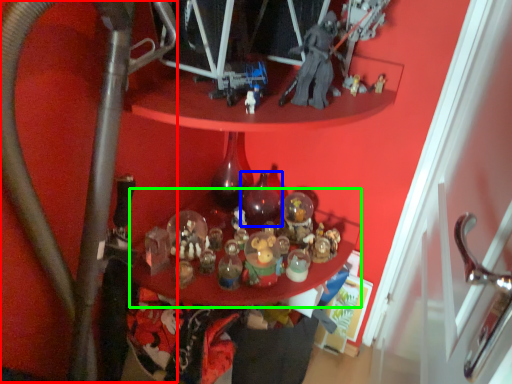
Question: Estimate the real-world distances between objects in this image. Which object is closer to water pipe (highlighted by a red box), bottle (highlighted by a blue box) or table (highlighted by a green box)?

Choices:
 (A) bottle
 (B) table

Answer: (B)